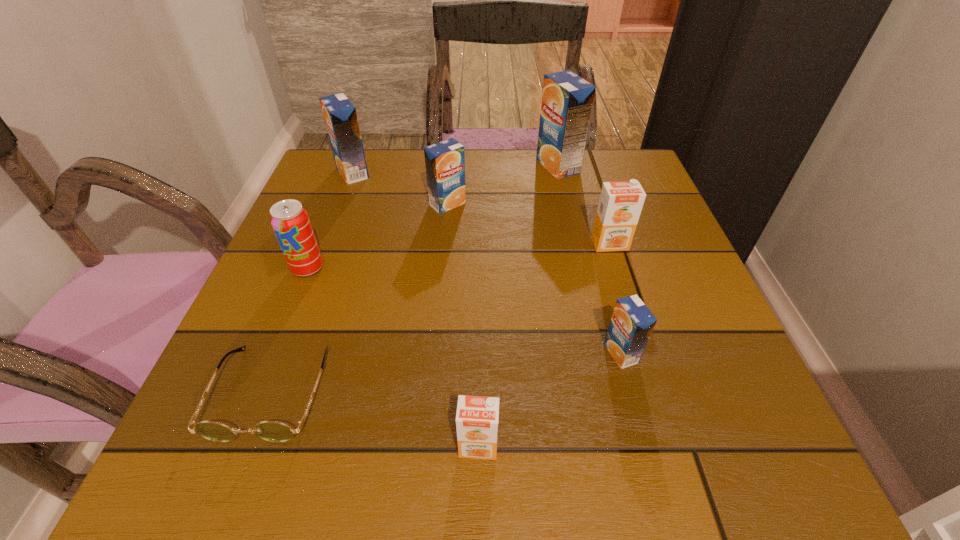
Where is `free space at the far edge`? free space at the far edge is located at coordinates (469, 188).

Locate an element on the screen. vacant space at the near edge of the desktop is located at coordinates (414, 475).

This screenshot has width=960, height=540. I want to click on vacant space at the left edge, so click(x=336, y=219).

I want to click on free space at the right edge of the desktop, so click(x=675, y=264).

This screenshot has width=960, height=540. In the image, there is a desktop. In order to click on free space at the far right corner in this screenshot , I will do `click(602, 173)`.

Image resolution: width=960 pixels, height=540 pixels. In order to click on vacant point located between the fifth orange juice from right to left and the farther orange orange juice in this screenshot , I will do `click(529, 224)`.

This screenshot has width=960, height=540. I want to click on vacant area that lies between the fifth farthest object and the second blue orange_juice from left to right, so click(x=377, y=236).

You are a GUI agent. You are given a task and a screenshot of the screen. Output one action in this format:
    pyautogui.click(x=<x>, y=<y>)
    Task: Click on the vacant region between the sixth nearest object and the spectacles
    The height and width of the screenshot is (540, 960).
    Given the screenshot: What is the action you would take?
    pyautogui.click(x=359, y=298)

The width and height of the screenshot is (960, 540). What are the coordinates of `vacant area that lies between the fourth object from left to right and the fifth shortest orange juice` in the screenshot? It's located at (400, 188).

Where is `free space between the fourth object from left to right and the spectacles`? This screenshot has height=540, width=960. free space between the fourth object from left to right and the spectacles is located at coordinates (359, 298).